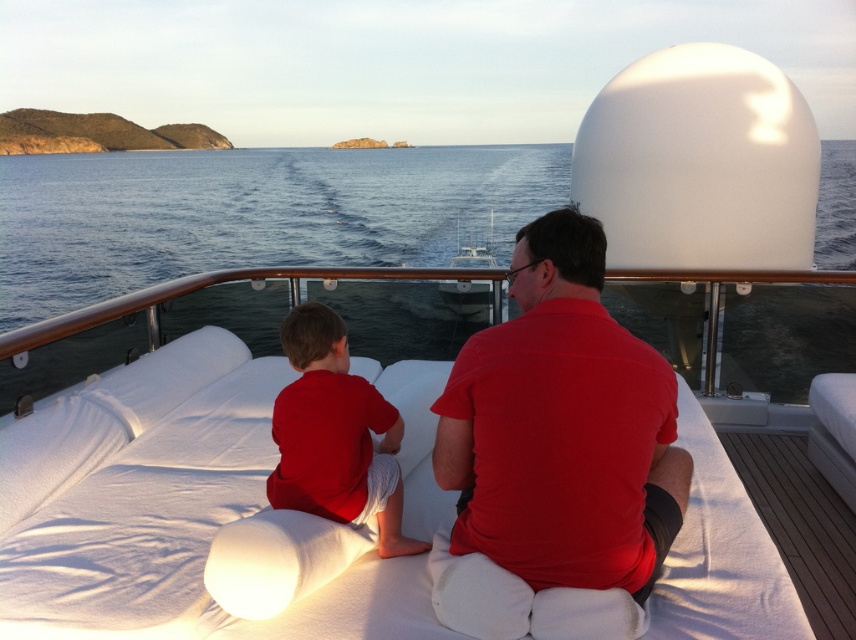
Question: Which of the following is the closest to the observer?

Choices:
 (A) white wood deck at lower right
 (B) matte red shirt at center

Answer: (B)

Question: Does matte red shirt at center appear under white wood deck at lower right?

Choices:
 (A) yes
 (B) no

Answer: (B)

Question: Among these objects, which one is nearest to the camera?

Choices:
 (A) white wood deck at lower right
 (B) matte red shirt at center

Answer: (B)

Question: Based on their relative distances, which object is nearer to the white wood deck at lower right?

Choices:
 (A) matte red shirt at center
 (B) red matte shirt at center

Answer: (B)

Question: Is red matte shirt at center thinner than white wood deck at lower right?

Choices:
 (A) no
 (B) yes

Answer: (B)

Question: In this image, where is matte red shirt at center located relative to white wood deck at lower right?

Choices:
 (A) left
 (B) right

Answer: (A)